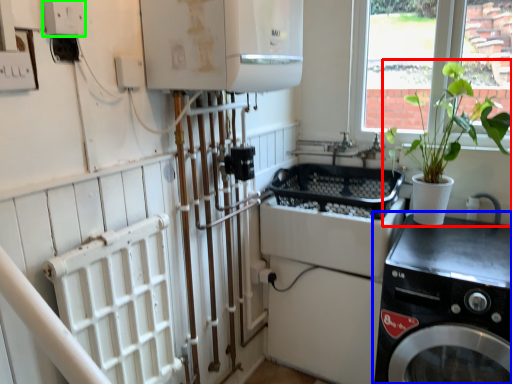
Question: Estimate the real-world distances between objects in this image. Which object is closer to houseplant (highlighted by a red box), washing machine (highlighted by a blue box) or electric outlet (highlighted by a green box)?

Choices:
 (A) washing machine
 (B) electric outlet

Answer: (A)